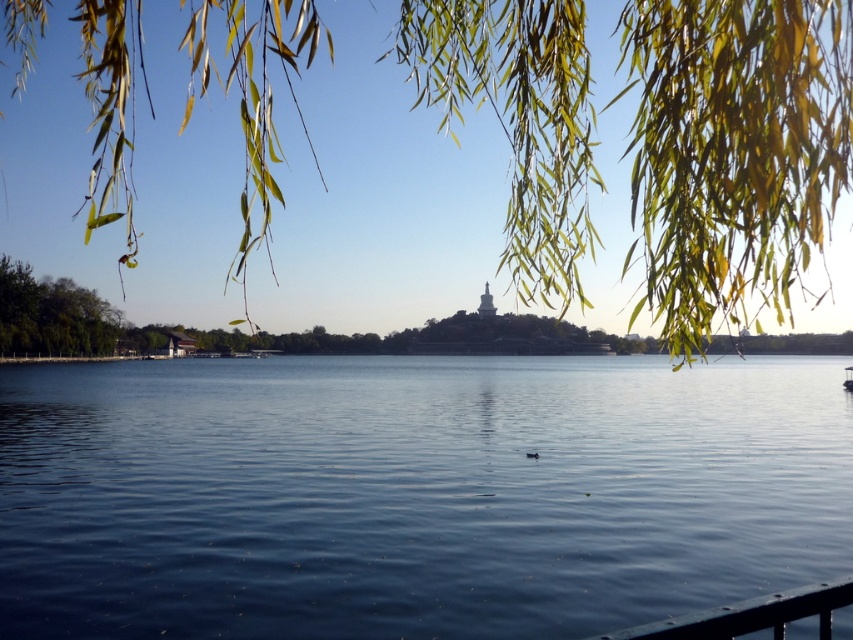
Question: Does blue water at center lie behind green leafy willow at upper center?

Choices:
 (A) no
 (B) yes

Answer: (B)

Question: Is green leafy tree at left behind black metal rail at lower right?

Choices:
 (A) yes
 (B) no

Answer: (A)

Question: Which point is farther to the camera?

Choices:
 (A) (1, 436)
 (B) (111, 349)
 (C) (851, 372)
 (D) (541, 292)

Answer: (B)

Question: Is blue water at center closer to the viewer compared to black metal rail at lower right?

Choices:
 (A) yes
 (B) no

Answer: (B)

Question: Which object is farther from the camera taking this photo?

Choices:
 (A) black metal rail at lower right
 (B) green leafy willow at upper center

Answer: (B)

Question: Which object appears farthest from the camera in this image?

Choices:
 (A) black metal rail at lower right
 (B) white plastic boat at center
 (C) green leafy willow at upper center
 (D) green leafy tree at left

Answer: (D)